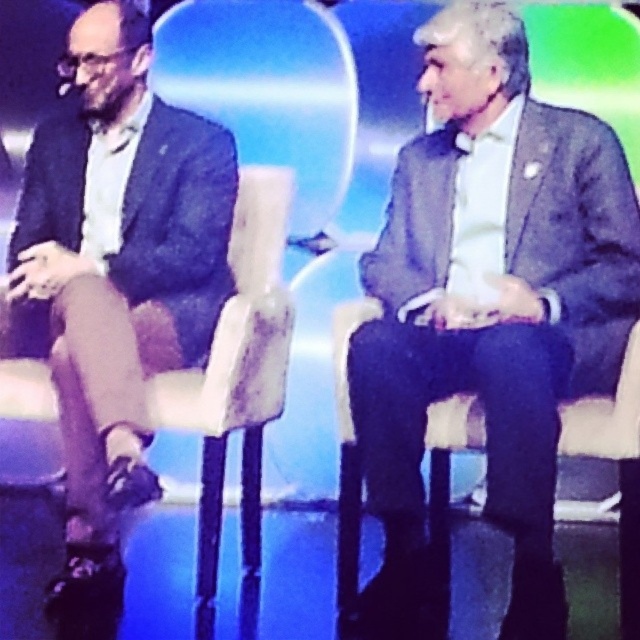
You are a photographer standing in front of the stage. You need to capture a photo where both the dark blue textured suit at left and the leather textured chair at left are clearly visible. However, you notice that focusing on one makes the other blurry. Which object should you focus on to ensure both are in focus?

You should focus on the dark blue textured suit at left because it is closer to you than the leather textured chair at left, so focusing on the closer object will keep both in focus.

You are an event organizer setting up a photo shoot in the studio. You need to position a large camera to capture both the dark blue textured suit at left and the leather textured chair at left. Since the camera can only focus on objects within a 1.2 meter width, can both objects fit within the camera frame if they are positioned side by side?

The dark blue textured suit at left is to the left of the leather textured chair at left, so they are positioned side by side. Since the camera can focus on objects within a 1.2 meter width, both objects can fit within the camera frame if their combined width is less than or equal to 1.2 meters. However, the exact distance between them isn not provided, so we cannot confirm without additional information.

You are an event organizer who needs to place a 1 meter wide decorative screen between the matte gray suit at center and the dark blue textured suit at left. Based on the space between them, will the screen fit without overlapping either suit?

The distance between the matte gray suit at center and the dark blue textured suit at left is 84.26 centimeters. Since the screen is 1 meter wide, it will not fit as the space is narrower than the screen. Consider a smaller screen or adjusting the seating positions.